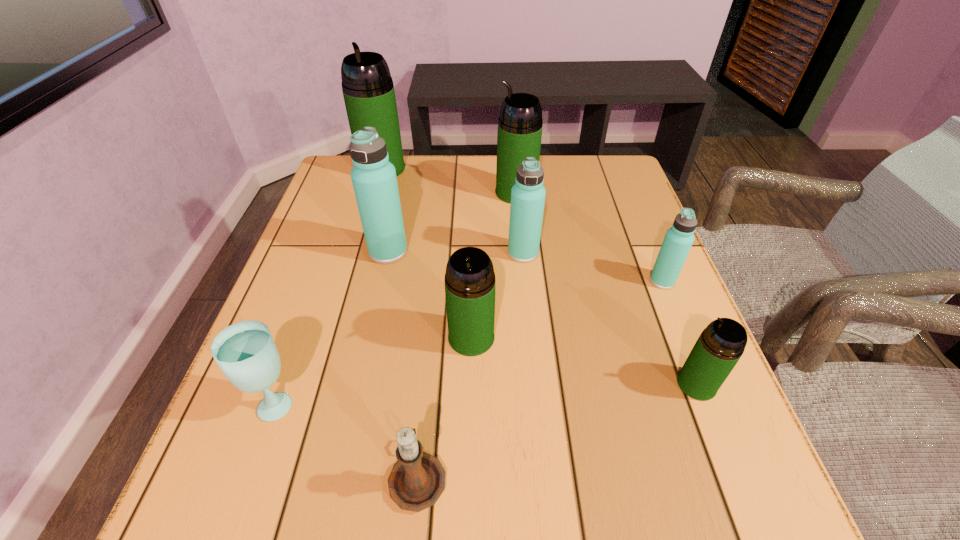
The height and width of the screenshot is (540, 960). Identify the location of the nearest green thermos bottle. (721, 344).

Locate an element on the screen. Image resolution: width=960 pixels, height=540 pixels. glass is located at coordinates (245, 351).

Find the location of a particular element. The height and width of the screenshot is (540, 960). candle holder is located at coordinates (417, 480).

I want to click on vacant space located from the spout of the biggest green thermos bottle, so click(358, 251).

Where is `vacant space located 0.100m from the spout of the second green thermos bottle from right to left`? vacant space located 0.100m from the spout of the second green thermos bottle from right to left is located at coordinates (458, 193).

Find the location of a particular element. vacant space located from the spout of the second green thermos bottle from right to left is located at coordinates click(x=351, y=193).

Find the location of `vacant space located from the spout of the second green thermos bottle from right to left`. vacant space located from the spout of the second green thermos bottle from right to left is located at coordinates (403, 193).

This screenshot has height=540, width=960. I want to click on vacant region located 0.050m on the left of the biggest aqua thermos bottle, so click(348, 252).

The image size is (960, 540). Find the location of `free space located 0.050m from the spout of the second nearest green thermos bottle`. free space located 0.050m from the spout of the second nearest green thermos bottle is located at coordinates (470, 381).

Find the location of a particular element. This screenshot has height=540, width=960. vacant space located on the left of the second aqua thermos bottle from right to left is located at coordinates (370, 253).